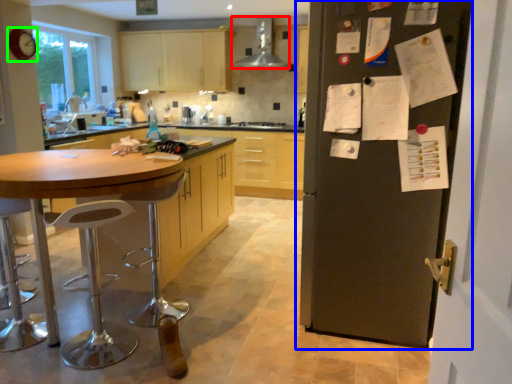
Question: Which is nearer to the kitchen appliance (highlighted by a red box)? door (highlighted by a blue box) or clock (highlighted by a green box).

Choices:
 (A) door
 (B) clock

Answer: (B)